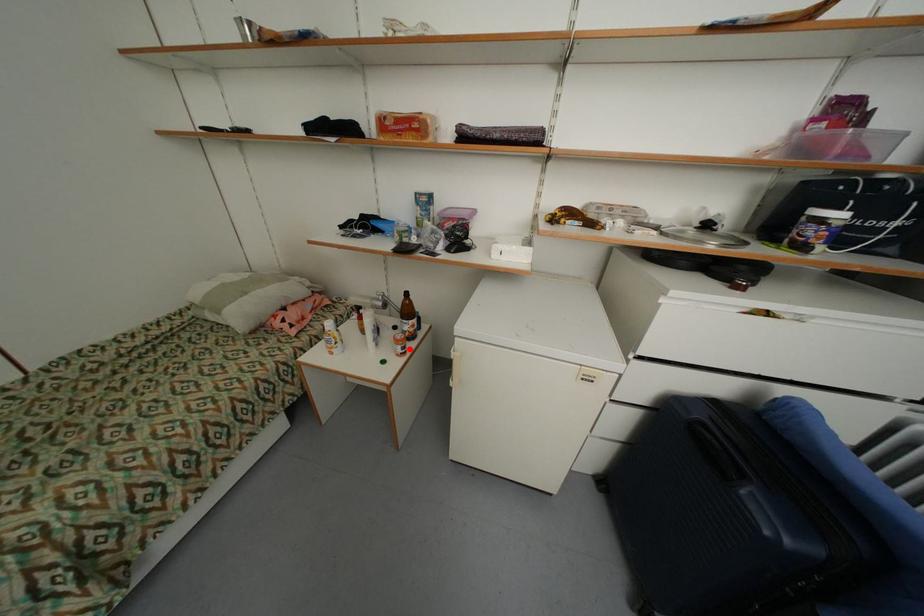
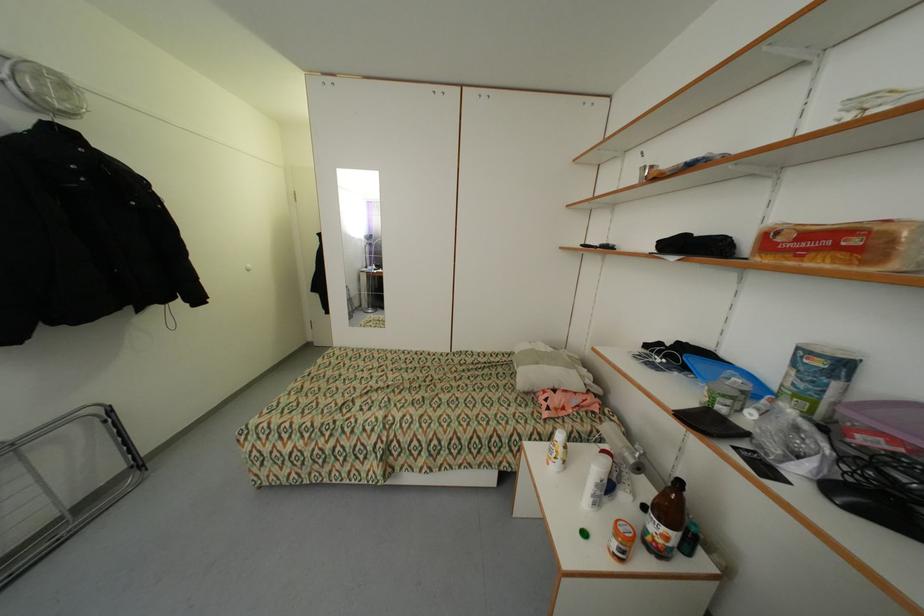
In the second image, find the point that corresponds to the highlighted location in the first image.

(627, 552)